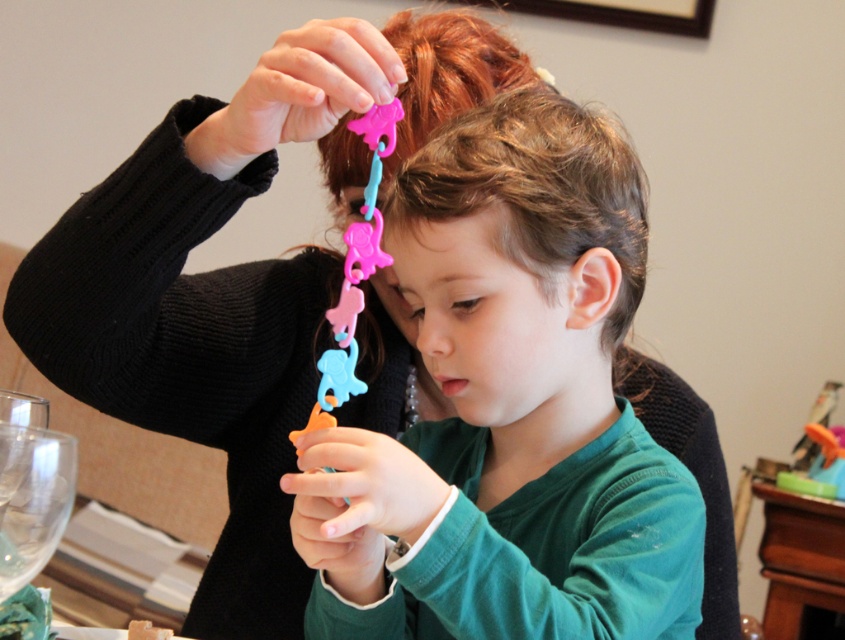
Question: Considering the relative positions of matte plastic toy at center and translucent plastic toy at lower right in the image provided, where is matte plastic toy at center located with respect to translucent plastic toy at lower right?

Choices:
 (A) above
 (B) below

Answer: (A)

Question: Based on their relative distances, which object is farther from the matte plastic toy at center?

Choices:
 (A) rubber elephant chain at upper center
 (B) translucent plastic toy at lower right

Answer: (B)

Question: Which object is farther from the camera taking this photo?

Choices:
 (A) brown matte hair at center
 (B) matte plastic toy at center

Answer: (A)

Question: Is rubber elephant chain at upper center above translucent plastic toy at lower right?

Choices:
 (A) yes
 (B) no

Answer: (A)

Question: Which point appears closest to the camera in this image?

Choices:
 (A) (613, 307)
 (B) (333, 333)

Answer: (A)

Question: Can you confirm if brown matte hair at center is positioned below rubber elephant chain at upper center?

Choices:
 (A) yes
 (B) no

Answer: (A)